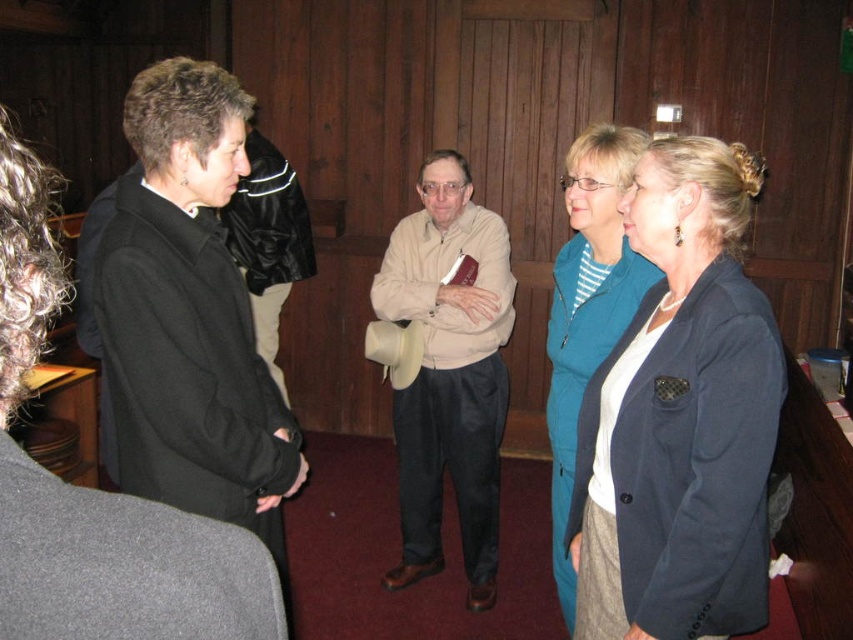
You are a photographer standing in the wooden room. You need to take a photo of both the navy blue blazer at center and the black woolen jacket at left. Which jacket should you focus on first to ensure both are in the frame?

You should focus on the navy blue blazer at center first because it is in front of the black woolen jacket at left, so it will be easier to position both in the frame by starting with the closer object.

You are a tailor who needs to determine which jacket requires more fabric to make between the navy blue blazer at center and the black woolen jacket at left. Based on their thickness, which one would need more fabric?

The black woolen jacket at left requires more fabric because it is thicker than the navy blue blazer at center.

You are standing in the wooden room and need to locate the black woolen jacket at left and the teal fabric jacket at center. Which one is positioned to the left of the other?

The black woolen jacket at left is to the left of the teal fabric jacket at center.